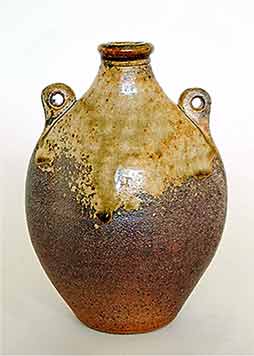
Find the location of a particular element. gold area of vase is located at coordinates (164, 147).